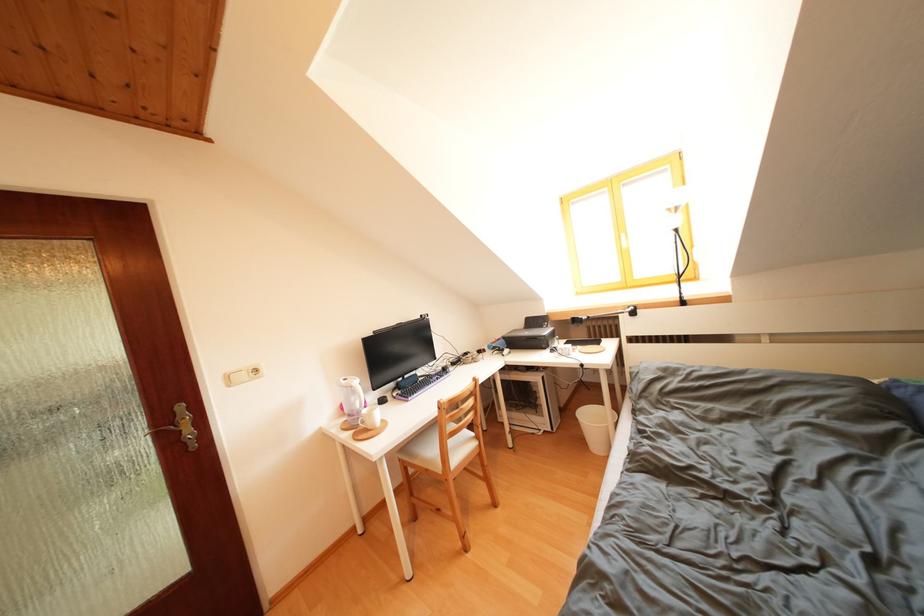
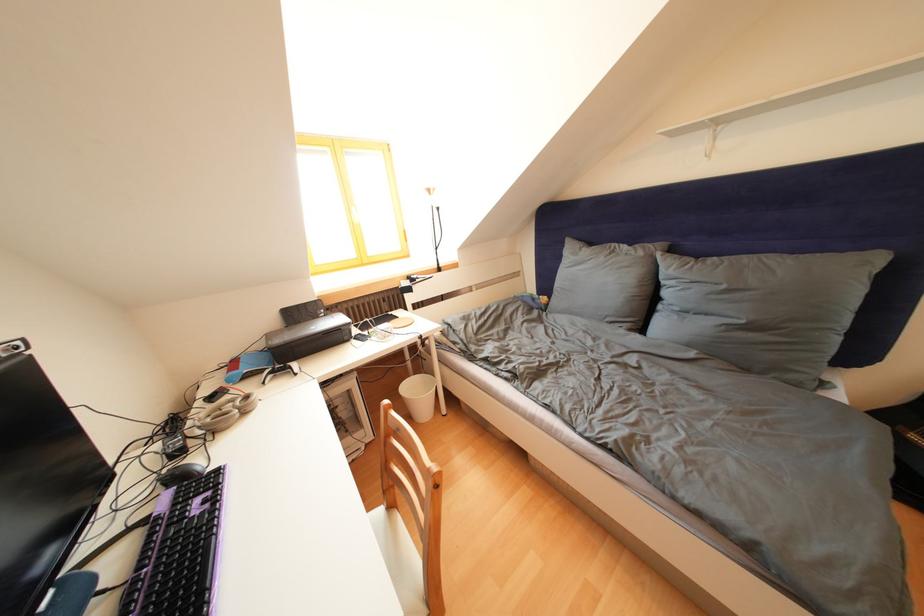
Find the pixel in the second image that matches (x=549, y=331) in the first image.

(323, 322)